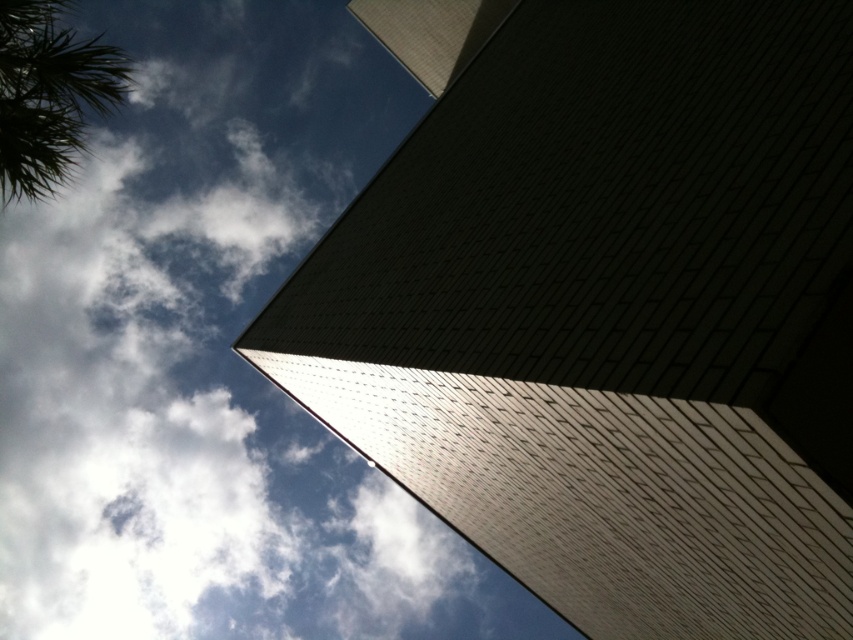
You are standing at the base of the skyscraper and notice a point marked at coordinate (x=201, y=353). What object is located at that point?

The point at coordinate (x=201, y=353) corresponds to the white fluffy cloud at upper left.

You are standing at the base of the skyscraper and notice a white fluffy cloud at upper left and a green leafy palm tree at upper left in the scene. Which object appears taller from your perspective?

The white fluffy cloud at upper left appears taller than the green leafy palm tree at upper left from your perspective.

You are standing at the base of the skyscraper looking up. You notice a white fluffy cloud at upper left and a green leafy palm tree at upper left. Which object is closer to the top of the skyscraper?

The white fluffy cloud at upper left is below the green leafy palm tree at upper left, so the palm tree is closer to the top of the skyscraper.